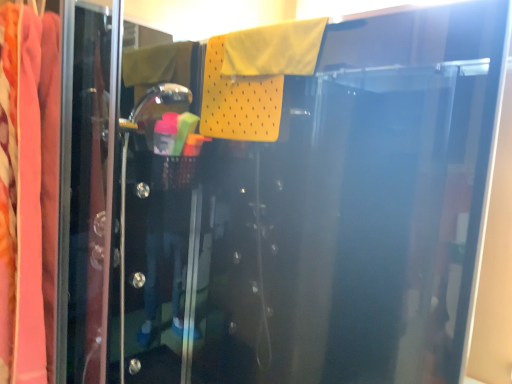
In order to face velvet pink fabric at left, should I rotate leftwards or rightwards?

You should rotate left by 30.648 degrees.

The height and width of the screenshot is (384, 512). Identify the location of velvet pink fabric at left. (21, 197).

What do you see at coordinates (21, 197) in the screenshot? This screenshot has width=512, height=384. I see `velvet pink fabric at left` at bounding box center [21, 197].

The height and width of the screenshot is (384, 512). In order to click on velvet pink fabric at left in this screenshot , I will do `click(21, 197)`.